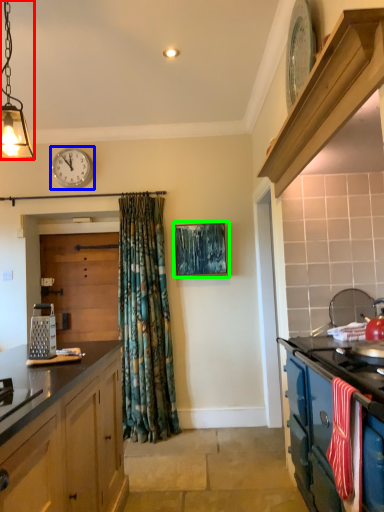
Question: Which object is the farthest from light fixture (highlighted by a red box)? Choose among these: clock (highlighted by a blue box) or picture frame (highlighted by a green box).

Choices:
 (A) clock
 (B) picture frame

Answer: (B)